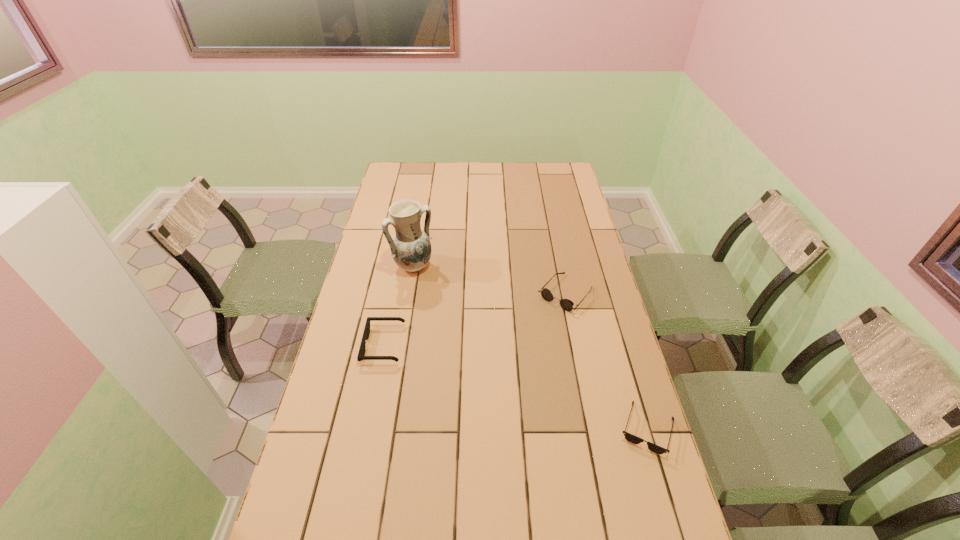
Where is `the third closest object to the nearest sunglasses`? The image size is (960, 540). the third closest object to the nearest sunglasses is located at coordinates (410, 247).

Locate which object ranks third in proximity to the leftmost sunglasses. Please provide its 2D coordinates. Your answer should be formatted as a tuple, i.e. [(x, y)], where the tuple contains the x and y coordinates of a point satisfying the conditions above.

[(633, 439)]

Choose which sunglasses is the third nearest neighbor to the pottery. Please provide its 2D coordinates. Your answer should be formatted as a tuple, i.e. [(x, y)], where the tuple contains the x and y coordinates of a point satisfying the conditions above.

[(633, 439)]

Select which sunglasses is the second closest to the nearest object. Please provide its 2D coordinates. Your answer should be formatted as a tuple, i.e. [(x, y)], where the tuple contains the x and y coordinates of a point satisfying the conditions above.

[(361, 356)]

You are a GUI agent. You are given a task and a screenshot of the screen. Output one action in this format:
    pyautogui.click(x=<x>, y=<y>)
    Task: Click on the vacant space that satisfies the following two spatial constraints: 1. on the front side of the pottery; 2. on the right side of the tallest sunglasses
    The image size is (960, 540).
    Given the screenshot: What is the action you would take?
    pyautogui.click(x=409, y=294)